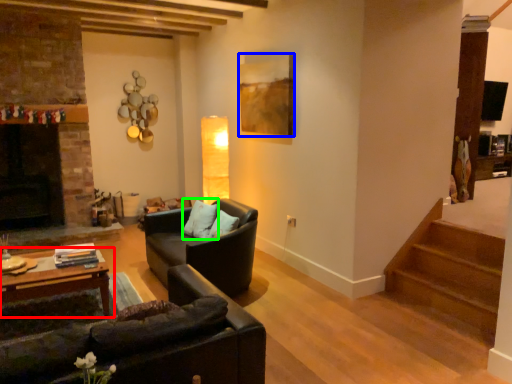
Question: Which is nearer to the table (highlighted by a red box)? picture frame (highlighted by a blue box) or pillow (highlighted by a green box).

Choices:
 (A) picture frame
 (B) pillow

Answer: (B)